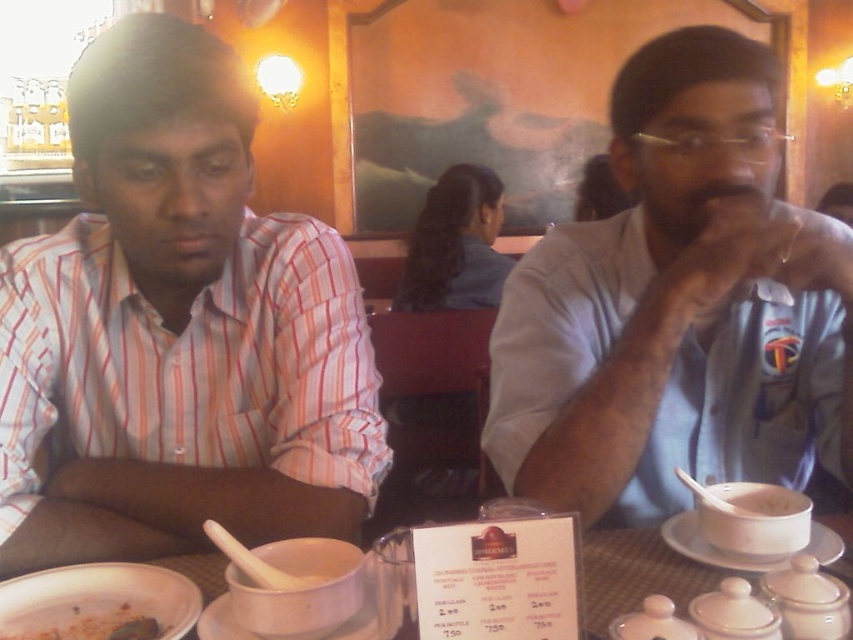
Question: Which object appears closest to the camera in this image?

Choices:
 (A) white paper menu at center
 (B) brown matte bowl at lower left
 (C) white matte rice at right
 (D) porcelain white bowl at center

Answer: (A)

Question: From the image, what is the correct spatial relationship of striped cotton shirt at left in relation to dirty white plate at lower left?

Choices:
 (A) right
 (B) left

Answer: (B)

Question: Which point is closer to the camera taking this photo?

Choices:
 (A) (561, 524)
 (B) (132, 602)

Answer: (A)

Question: Is the position of white paper menu at center more distant than that of white matte rice at right?

Choices:
 (A) no
 (B) yes

Answer: (A)

Question: Does white paper menu at center appear over white matte rice at right?

Choices:
 (A) yes
 (B) no

Answer: (B)

Question: Which object is positioned closest to the white paper menu at center?

Choices:
 (A) striped cotton shirt at left
 (B) white matte rice at right
 (C) brown matte bowl at lower left

Answer: (C)